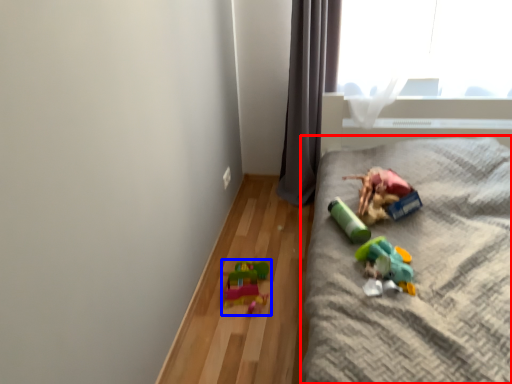
Question: Among these objects, which one is nearest to the camera, furniture (highlighted by a red box) or toy (highlighted by a blue box)?

Choices:
 (A) furniture
 (B) toy

Answer: (A)